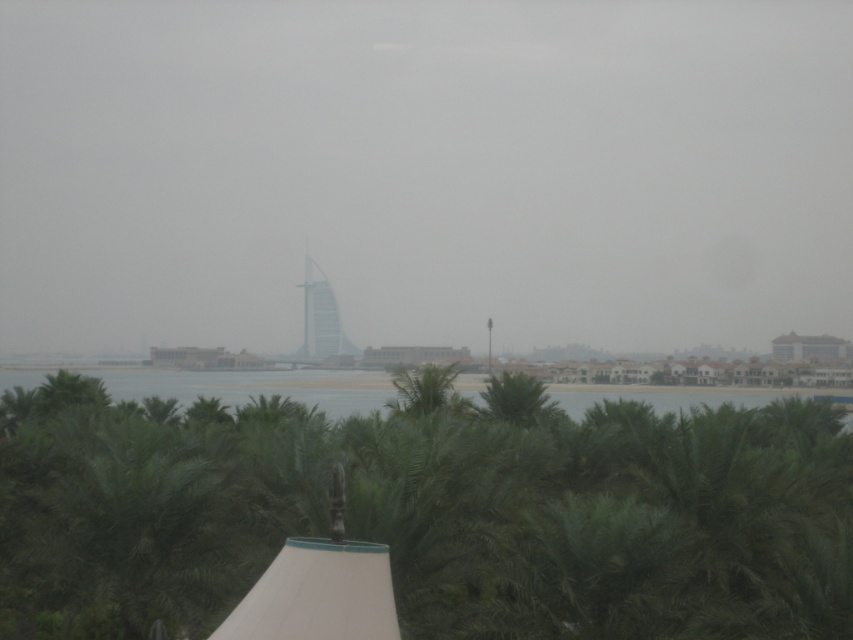
Who is higher up, green leafy tree at center or green leafy water at center?

green leafy tree at center is above.

This screenshot has height=640, width=853. I want to click on green leafy tree at center, so click(x=428, y=513).

The width and height of the screenshot is (853, 640). Identify the location of transparent glass skyscraper at center. (424, 172).

Which is below, transparent glass skyscraper at center or glassy white sail at center?

glassy white sail at center

From the picture: Who is more forward, (366, 296) or (312, 333)?

Point (312, 333)

Find the location of a particular element. This screenshot has width=853, height=640. transparent glass skyscraper at center is located at coordinates (424, 172).

Who is taller, transparent glass skyscraper at center or green leafy water at center?

transparent glass skyscraper at center

Is transparent glass skyscraper at center taller than green leafy water at center?

Yes.

Is point (769, 99) positioned after point (219, 380)?

Yes.

You are a GUI agent. You are given a task and a screenshot of the screen. Output one action in this format:
    pyautogui.click(x=<x>, y=<y>)
    Task: Click on the transparent glass skyscraper at center
    Image resolution: width=853 pixels, height=640 pixels.
    Given the screenshot: What is the action you would take?
    pyautogui.click(x=424, y=172)